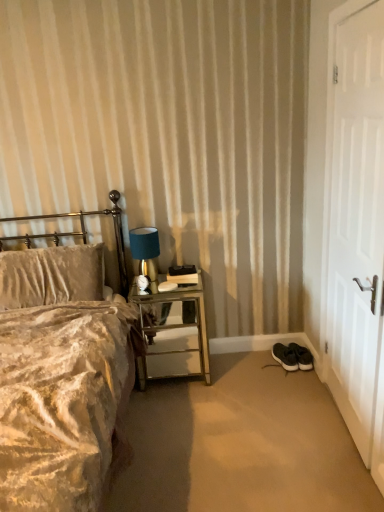
In order to click on vacant area that lies to the right of mirrored glass nightstand at center in this screenshot , I will do `click(242, 376)`.